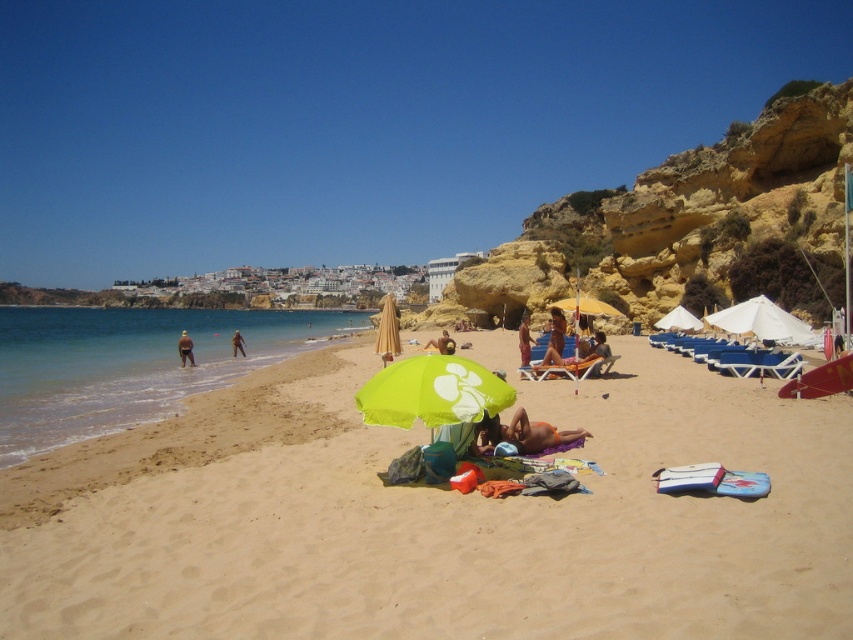
You are a beachgoer who wants to place a cooler between the orange fabric towel at center and the yellow fabric umbrella at center. Since the cooler is 2 meters wide, will there be enough space between them?

The orange fabric towel at center is thinner than the yellow fabric umbrella at center, but the description does not provide the exact distance between them. Therefore, it is unclear if the 2 meter wide cooler will fit between them.